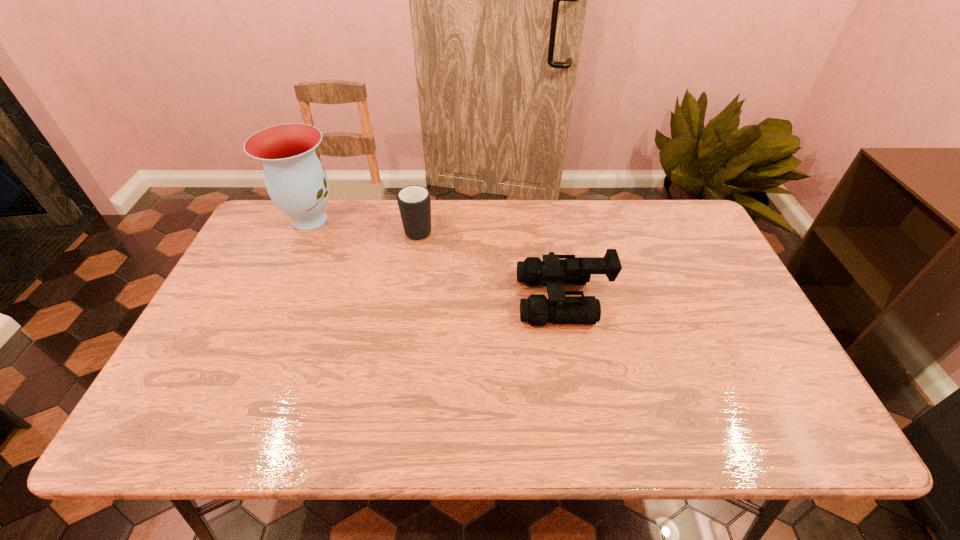
The image size is (960, 540). Find the location of `the tallest object`. the tallest object is located at coordinates (296, 181).

At what (x,y) coordinates should I click in order to perform the action: click on the leftmost object. Please return your answer as a coordinate pair (x, y). Looking at the image, I should click on (296, 181).

At what (x,y) coordinates should I click in order to perform the action: click on binoculars. Please return your answer as a coordinate pair (x, y). This screenshot has height=540, width=960. Looking at the image, I should click on (555, 270).

Locate an element on the screen. Image resolution: width=960 pixels, height=540 pixels. the nearest object is located at coordinates (555, 270).

In order to click on the second object from right to left in this screenshot , I will do `click(414, 201)`.

The width and height of the screenshot is (960, 540). In order to click on vacant area located on the right of the vase in this screenshot , I will do 418,219.

This screenshot has width=960, height=540. I want to click on free space located 0.100m on the front lenses of the nearest object, so click(x=482, y=300).

Locate an element on the screen. free space located on the front lenses of the nearest object is located at coordinates (420, 300).

In order to click on vacant point located 0.100m on the front lenses of the nearest object in this screenshot , I will do `click(482, 300)`.

Where is `vase present at the far edge`? vase present at the far edge is located at coordinates (296, 181).